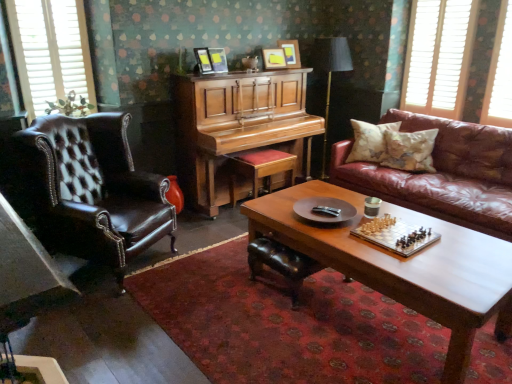
This screenshot has height=384, width=512. Find the location of `vacant space that is to the left of metallic chess set at center`. vacant space that is to the left of metallic chess set at center is located at coordinates (347, 244).